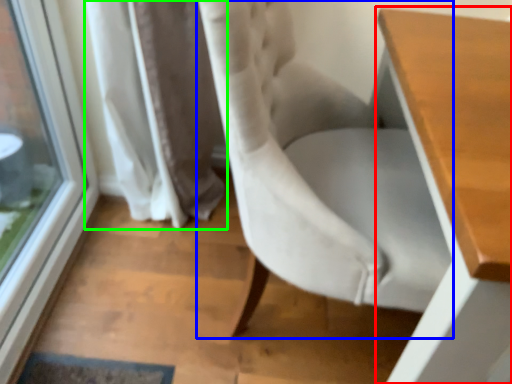
Question: Based on their relative distances, which object is farther from table (highlighted by a red box)? Choose from chair (highlighted by a blue box) and curtain (highlighted by a green box).

Choices:
 (A) chair
 (B) curtain

Answer: (B)